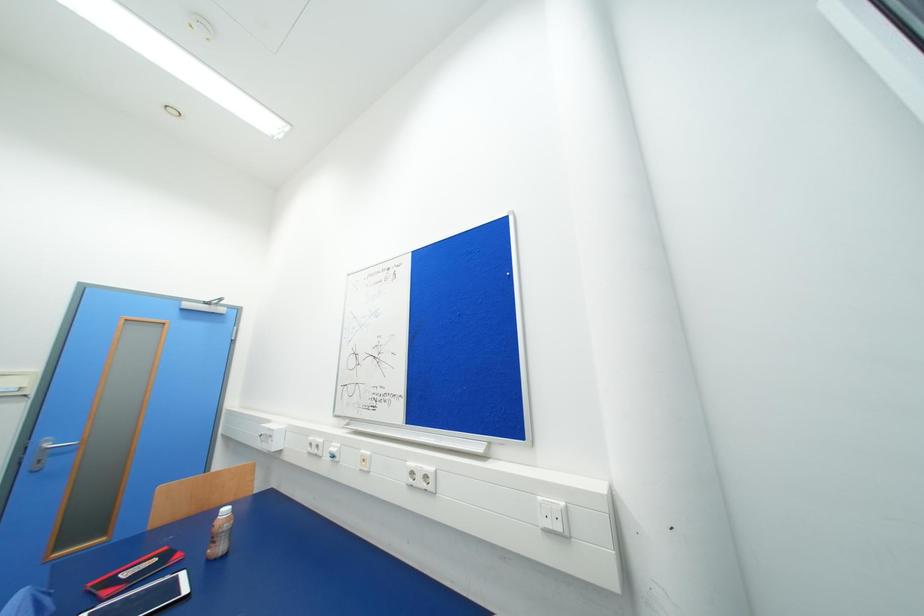
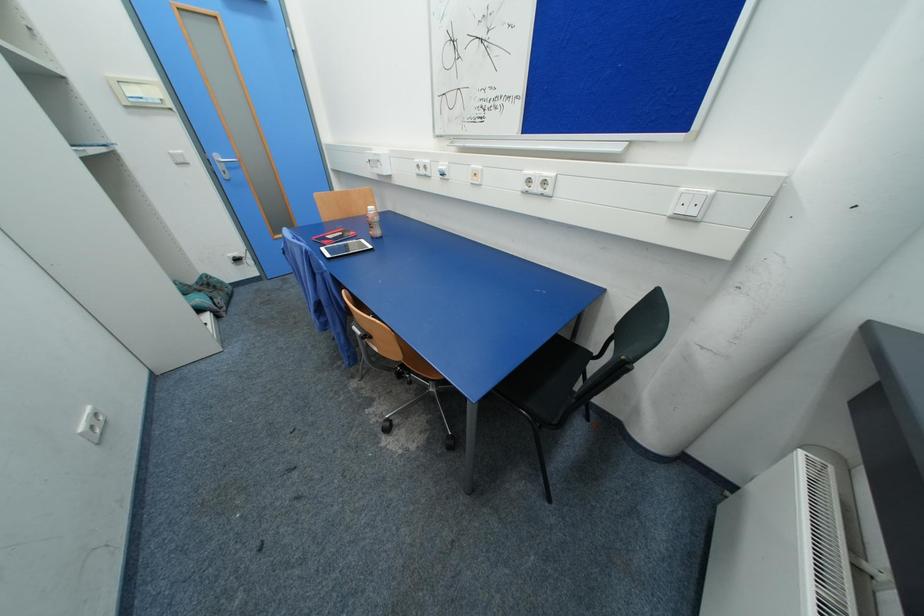
First-person continuous shooting, in which direction is the camera rotating?

The rotation direction of the camera is left-down.